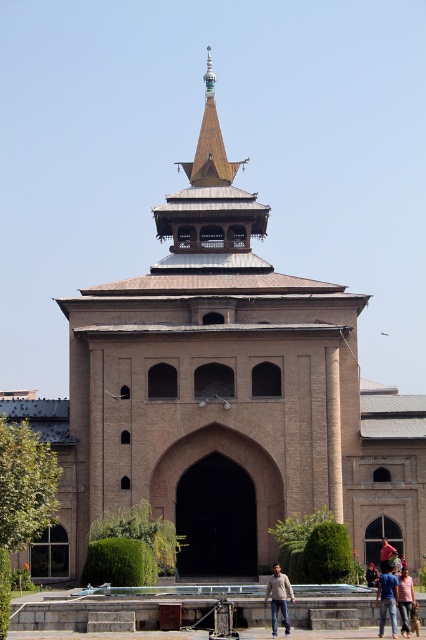
Identify the location of wooden spire at upper center. The height and width of the screenshot is (640, 426). (210, 209).

Between wooden spire at upper center and blue cotton shirt at lower center, which one has more height?

With more height is wooden spire at upper center.

Consider the image. Who is more distant from viewer, (178, 262) or (385, 604)?

Positioned behind is point (178, 262).

At what (x,y) coordinates should I click in order to perform the action: click on wooden spire at upper center. Please return your answer as a coordinate pair (x, y). Looking at the image, I should click on (210, 209).

Can you confirm if light brown leather jacket at lower center is positioned to the left of light blue denim jeans at lower center?

Correct, you'll find light brown leather jacket at lower center to the left of light blue denim jeans at lower center.

Which is behind, point (276, 609) or point (397, 604)?

The point (276, 609) is behind.

Is point (282, 573) farther from viewer compared to point (408, 600)?

That is True.

Locate an element on the screen. light brown leather jacket at lower center is located at coordinates (279, 596).

Does light brown leather jacket at lower center appear on the right side of blue denim jeans at center?

No, light brown leather jacket at lower center is not to the right of blue denim jeans at center.

Does light brown leather jacket at lower center have a lesser width compared to blue denim jeans at center?

Incorrect, light brown leather jacket at lower center's width is not less than blue denim jeans at center's.

The height and width of the screenshot is (640, 426). I want to click on light brown leather jacket at lower center, so click(x=279, y=596).